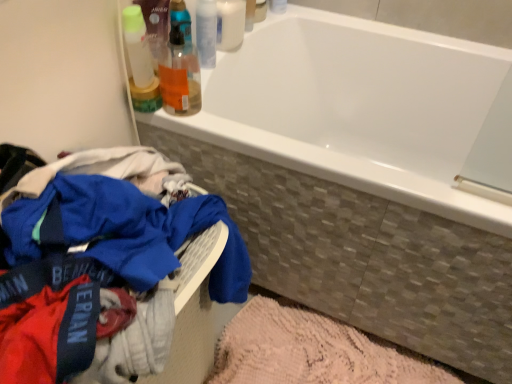
Question: Is white glossy bottle at upper center, placed as the 1th toiletry when sorted from top to bottom, wider or thinner than white glossy bathtub at upper center?

Choices:
 (A) wide
 (B) thin

Answer: (B)

Question: Considering the positions of white glossy bottle at upper center, placed as the 1th toiletry when sorted from top to bottom, and white glossy bathtub at upper center in the image, is white glossy bottle at upper center, placed as the 1th toiletry when sorted from top to bottom, taller or shorter than white glossy bathtub at upper center?

Choices:
 (A) short
 (B) tall

Answer: (A)

Question: Which object is the farthest from the white glossy bottle at upper center, the second toiletry viewed from the top?

Choices:
 (A) translucent plastic bottles at upper left, which is the 3th toiletry from top to bottom
 (B) white glossy bathtub at upper center
 (C) blue cotton clothes at lower left
 (D) white glossy bottle at upper center, arranged as the 3th toiletry when ordered from the bottom
 (E) pink textured bath mat at lower center

Answer: (E)

Question: Which object is positioned closest to the pink textured bath mat at lower center?

Choices:
 (A) translucent plastic bottles at upper left, which is the 3th toiletry from top to bottom
 (B) blue cotton clothes at lower left
 (C) white glossy bottle at upper center, arranged as the 3th toiletry when ordered from the bottom
 (D) white glossy bottle at upper center, the second toiletry viewed from the top
 (E) white glossy bathtub at upper center

Answer: (B)